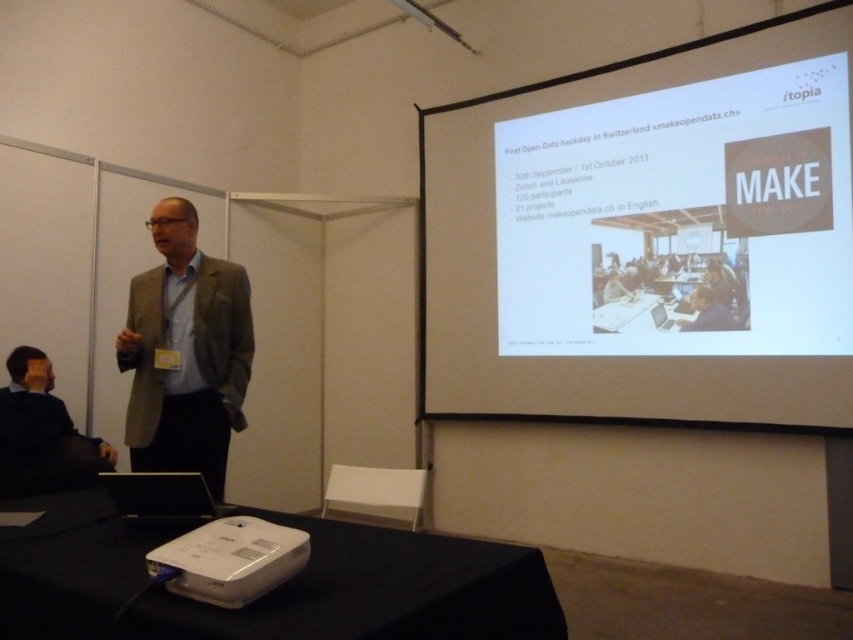
Which of these two, black fabric projector at lower left or light brown textured blazer at center, stands taller?

With more height is light brown textured blazer at center.

Is black fabric projector at lower left to the left of light brown textured blazer at center from the viewer's perspective?

Incorrect, black fabric projector at lower left is not on the left side of light brown textured blazer at center.

Does point (148, 544) come farther from viewer compared to point (154, 314)?

No, (148, 544) is closer to viewer.

What are the coordinates of `black fabric projector at lower left` in the screenshot? It's located at (375, 592).

Measure the distance from light brown textured blazer at center to black fabric jacket at lower left.

light brown textured blazer at center is 34.45 inches from black fabric jacket at lower left.

Who is more distant from viewer, (225, 337) or (86, 442)?

Point (86, 442)

Is point (222, 321) in front of point (68, 460)?

Yes, point (222, 321) is closer to viewer.

Locate an element on the screen. light brown textured blazer at center is located at coordinates coord(184,353).

Consider the image. Is white matte projection screen at upper right positioned at the back of black fabric jacket at lower left?

Yes, white matte projection screen at upper right is further from the viewer.

Is white matte projection screen at upper right above black fabric jacket at lower left?

Indeed, white matte projection screen at upper right is positioned over black fabric jacket at lower left.

The width and height of the screenshot is (853, 640). Find the location of `white matte projection screen at upper right`. white matte projection screen at upper right is located at coordinates (650, 240).